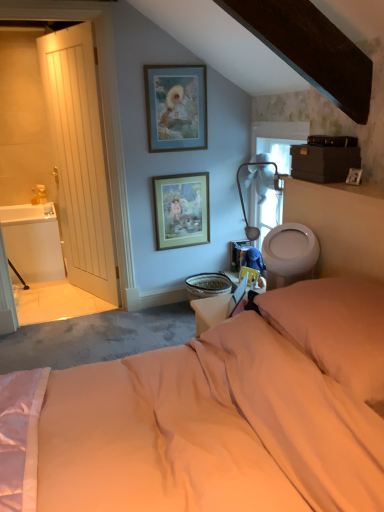
The height and width of the screenshot is (512, 384). What are the coordinates of `free space in front of white wooden door at left` in the screenshot? It's located at (72, 307).